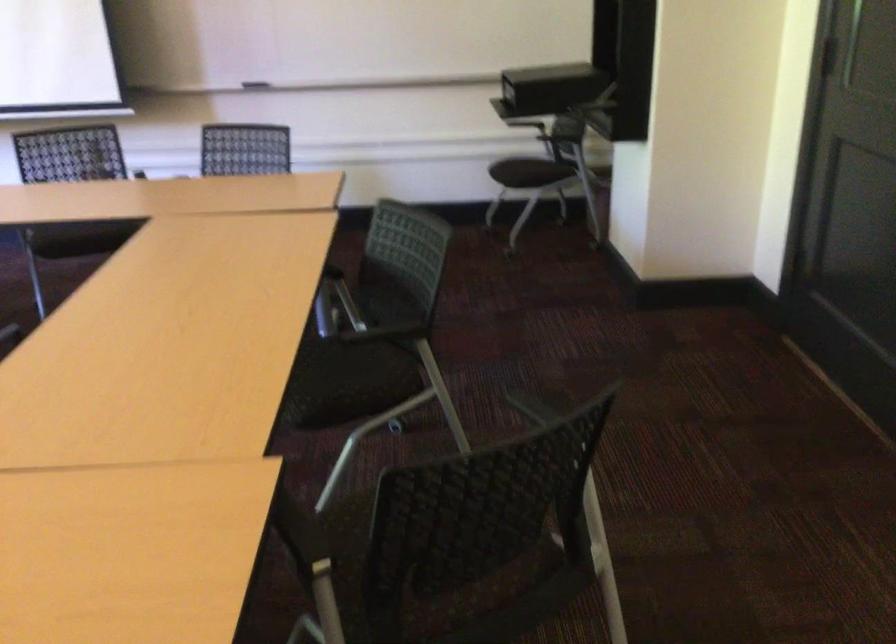
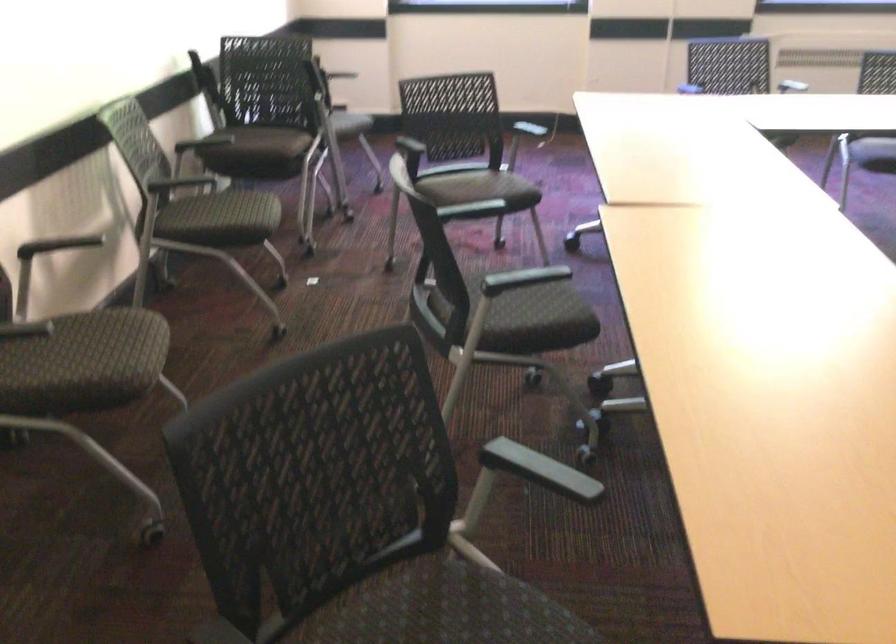
The first image is from the beginning of the video and the second image is from the end. How did the camera likely rotate when shooting the video?

The camera's rotation is toward left-down.